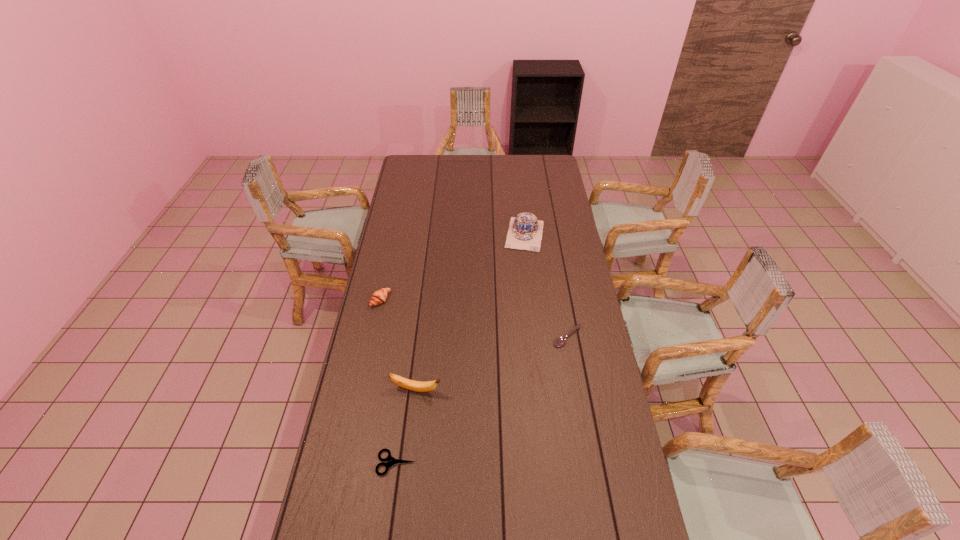
The width and height of the screenshot is (960, 540). What are the coordinates of `vacant space on the desktop that is between the shortest object and the third nearest object and is positioned at the stem of the fourth farthest object` in the screenshot? It's located at (480, 401).

The width and height of the screenshot is (960, 540). I want to click on free spot on the desktop that is between the shears and the third farthest object and is positioned on the front, side, and top of the cap, so click(x=498, y=388).

At what (x,y) coordinates should I click in order to perform the action: click on vacant space on the desktop that is between the nearest object and the third nearest object and is positioned on the front-facing side of the third shortest object. Please return your answer as a coordinate pair (x, y). Image resolution: width=960 pixels, height=540 pixels. Looking at the image, I should click on (515, 376).